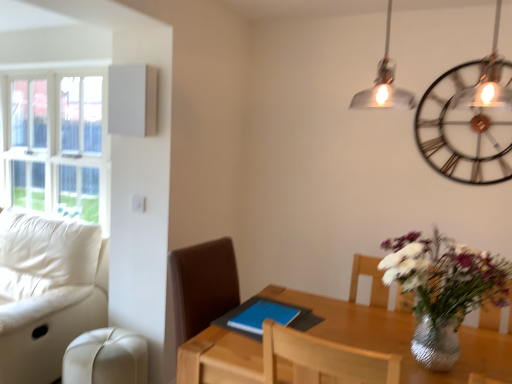
This screenshot has height=384, width=512. Identify the location of empty space that is ontop of wooden table at center. (354, 334).